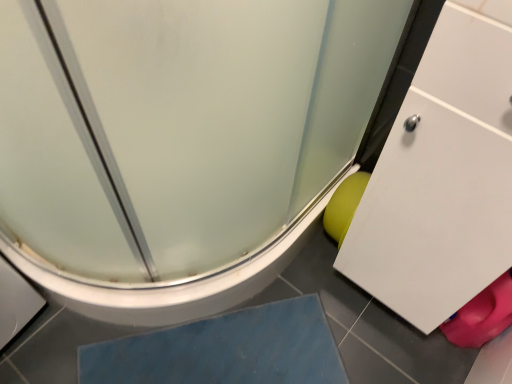
Question: Is blue rubber mat at lower center positioned with its back to frosted glass shower door at lower right?

Choices:
 (A) yes
 (B) no

Answer: (B)

Question: From the image's perspective, is blue rubber mat at lower center on frosted glass shower door at lower right?

Choices:
 (A) no
 (B) yes

Answer: (A)

Question: Can you confirm if blue rubber mat at lower center is thinner than frosted glass shower door at lower right?

Choices:
 (A) no
 (B) yes

Answer: (B)

Question: Considering the relative sizes of blue rubber mat at lower center and frosted glass shower door at lower right in the image provided, is blue rubber mat at lower center bigger than frosted glass shower door at lower right?

Choices:
 (A) yes
 (B) no

Answer: (B)

Question: Is blue rubber mat at lower center positioned before frosted glass shower door at lower right?

Choices:
 (A) yes
 (B) no

Answer: (B)

Question: Can you confirm if blue rubber mat at lower center is taller than frosted glass shower door at lower right?

Choices:
 (A) no
 (B) yes

Answer: (A)

Question: Does frosted glass shower door at lower right turn towards blue rubber mat at lower center?

Choices:
 (A) yes
 (B) no

Answer: (B)

Question: Considering the relative positions of frosted glass shower door at lower right and blue rubber mat at lower center in the image provided, is frosted glass shower door at lower right behind blue rubber mat at lower center?

Choices:
 (A) yes
 (B) no

Answer: (B)

Question: Is frosted glass shower door at lower right bigger than blue rubber mat at lower center?

Choices:
 (A) no
 (B) yes

Answer: (B)

Question: Is frosted glass shower door at lower right next to blue rubber mat at lower center and touching it?

Choices:
 (A) no
 (B) yes

Answer: (A)

Question: Would you say frosted glass shower door at lower right is a long distance from blue rubber mat at lower center?

Choices:
 (A) no
 (B) yes

Answer: (A)

Question: From a real-world perspective, is frosted glass shower door at lower right positioned under blue rubber mat at lower center based on gravity?

Choices:
 (A) yes
 (B) no

Answer: (B)

Question: From the image's perspective, relative to frosted glass shower door at lower right, is blue rubber mat at lower center above or below?

Choices:
 (A) above
 (B) below

Answer: (B)